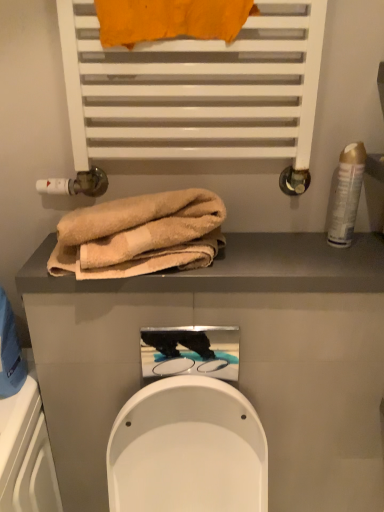
At what (x,y) coordinates should I click in order to perform the action: click on spots to the right of gold metallic can at right. Please return your answer as a coordinate pair (x, y). This screenshot has height=512, width=384. Looking at the image, I should click on (369, 244).